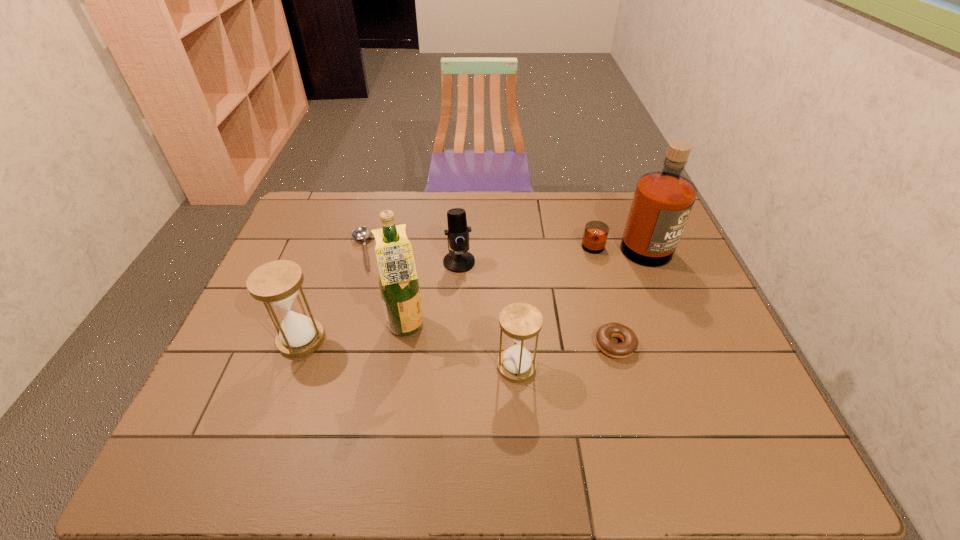
The width and height of the screenshot is (960, 540). I want to click on vacant space that satisfies the following two spatial constraints: 1. on the back side of the sixth tallest object; 2. on the front-facing side of the left liquor, so click(x=611, y=328).

What are the coordinates of `vacant space that satisfies the following two spatial constraints: 1. on the front label of the right liquor; 2. on the front-facing side of the nearer liquor` in the screenshot? It's located at (656, 328).

Image resolution: width=960 pixels, height=540 pixels. Identify the location of blank area in the image that satisfies the following two spatial constraints: 1. on the front label of the right liquor; 2. on the front-facing side of the left liquor. (656, 328).